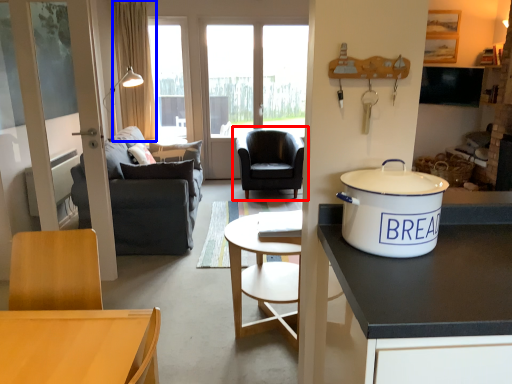
Question: Which point is closer to the camera, chair (highlighted by a red box) or curtain (highlighted by a blue box)?

Choices:
 (A) chair
 (B) curtain

Answer: (A)